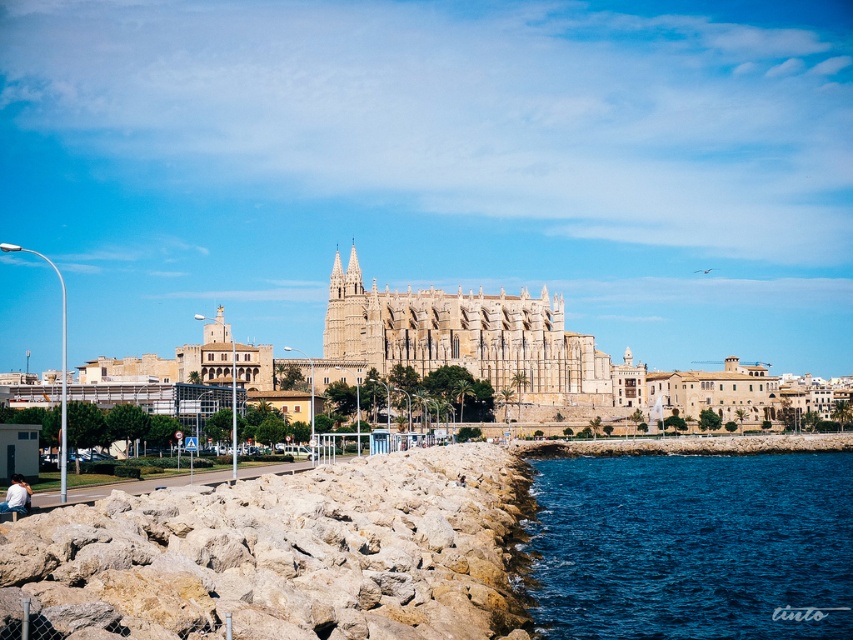
Is rocky at lower left in front of blue liquid water at lower right?

That is True.

Does rocky at lower left appear under blue liquid water at lower right?

No, rocky at lower left is not below blue liquid water at lower right.

Which is behind, point (212, 522) or point (611, 580)?

Positioned behind is point (611, 580).

The height and width of the screenshot is (640, 853). What are the coordinates of `rocky at lower left` in the screenshot? It's located at (281, 554).

Between point (718, 531) and point (16, 513), which one is positioned in front?

Point (16, 513)

Describe the element at coordinates (691, 545) in the screenshot. I see `blue liquid water at lower right` at that location.

Between point (577, 576) and point (10, 500), which one is positioned behind?

The point (577, 576) is behind.

You are a GUI agent. You are given a task and a screenshot of the screen. Output one action in this format:
    pyautogui.click(x=<x>, y=<y>)
    Task: Click on the blue liquid water at lower right
    Image resolution: width=853 pixels, height=640 pixels.
    Given the screenshot: What is the action you would take?
    pyautogui.click(x=691, y=545)

Is rocky at lower left shorter than white cotton shirt at lower left?

In fact, rocky at lower left may be taller than white cotton shirt at lower left.

Who is shorter, rocky at lower left or white cotton shirt at lower left?

Standing shorter between the two is white cotton shirt at lower left.

The image size is (853, 640). Identify the location of rocky at lower left. (281, 554).